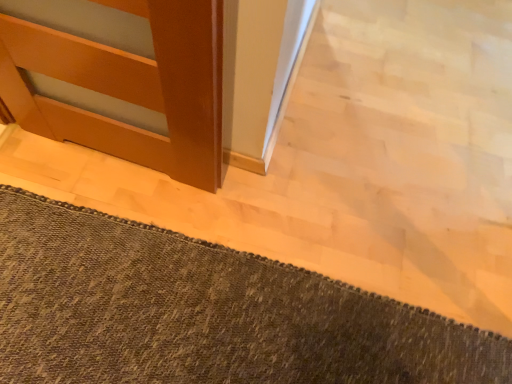
Question: Should I look upward or downward to see matte wood door at left?

Choices:
 (A) down
 (B) up

Answer: (B)

Question: Can you confirm if matte wood door at left is positioned to the right of brown woven rug at lower left?

Choices:
 (A) yes
 (B) no

Answer: (B)

Question: From a real-world perspective, does matte wood door at left sit lower than brown woven rug at lower left?

Choices:
 (A) yes
 (B) no

Answer: (B)

Question: Can you confirm if matte wood door at left is bigger than brown woven rug at lower left?

Choices:
 (A) yes
 (B) no

Answer: (B)

Question: Is matte wood door at left not close to brown woven rug at lower left?

Choices:
 (A) no
 (B) yes

Answer: (A)

Question: Is brown woven rug at lower left a part of matte wood door at left?

Choices:
 (A) no
 (B) yes

Answer: (A)

Question: From the image's perspective, is matte wood door at left located beneath brown woven rug at lower left?

Choices:
 (A) no
 (B) yes

Answer: (A)

Question: From a real-world perspective, is brown woven rug at lower left located higher than matte wood door at left?

Choices:
 (A) yes
 (B) no

Answer: (B)

Question: Does brown woven rug at lower left contain matte wood door at left?

Choices:
 (A) yes
 (B) no

Answer: (B)

Question: Is brown woven rug at lower left further to the viewer compared to matte wood door at left?

Choices:
 (A) no
 (B) yes

Answer: (B)

Question: From the image's perspective, is brown woven rug at lower left on top of matte wood door at left?

Choices:
 (A) yes
 (B) no

Answer: (B)

Question: Can you confirm if brown woven rug at lower left is taller than matte wood door at left?

Choices:
 (A) no
 (B) yes

Answer: (A)

Question: Is brown woven rug at lower left not within matte wood door at left?

Choices:
 (A) no
 (B) yes

Answer: (B)

Question: In terms of height, does brown woven rug at lower left look taller or shorter compared to matte wood door at left?

Choices:
 (A) tall
 (B) short

Answer: (B)